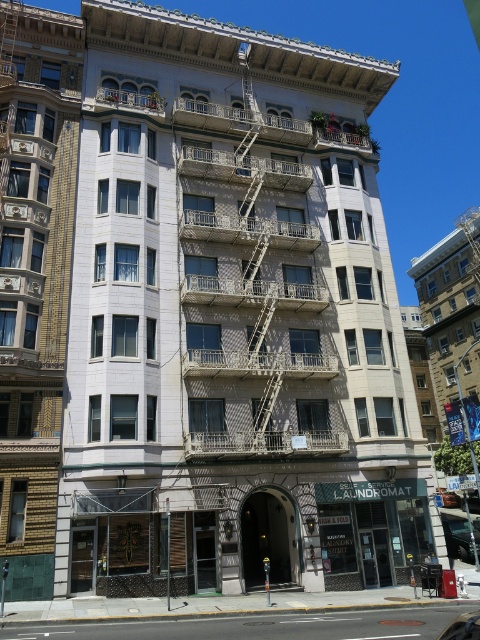
You are standing at the camera position and want to reach the point marked as point (x=304, y=154). Can you estimate how far you need to walk to get there?

The distance between the camera and point (x=304, y=154) is 41.11 meters, so you need to walk approximately 41.11 meters to reach it.

You are a delivery person trying to park your metallic silver car at lower right. The building has a metallic silver fire escape at center. Will your car block the fire escape when parked?

The metallic silver car at lower right is behind the metallic silver fire escape at center, so parking it there will not block the fire escape.

You are standing in front of the building and want to locate the metallic silver fire escape at center. According to the coordinates provided, where should you look relative to the building?

The metallic silver fire escape at center is located at coordinates point [253,280], which means it is positioned slightly to the right and above the center point of the building.